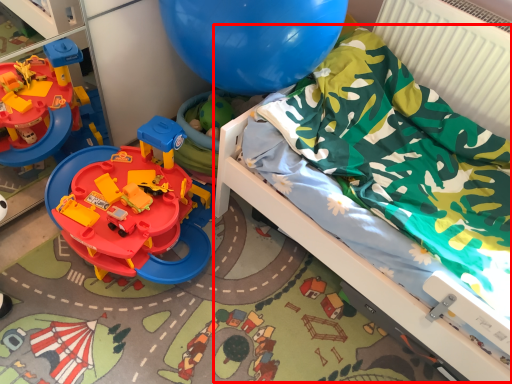
Question: From the image's perspective, what is the correct spatial positioning of bed (annotated by the red box) in reference to radiator?

Choices:
 (A) above
 (B) below

Answer: (B)